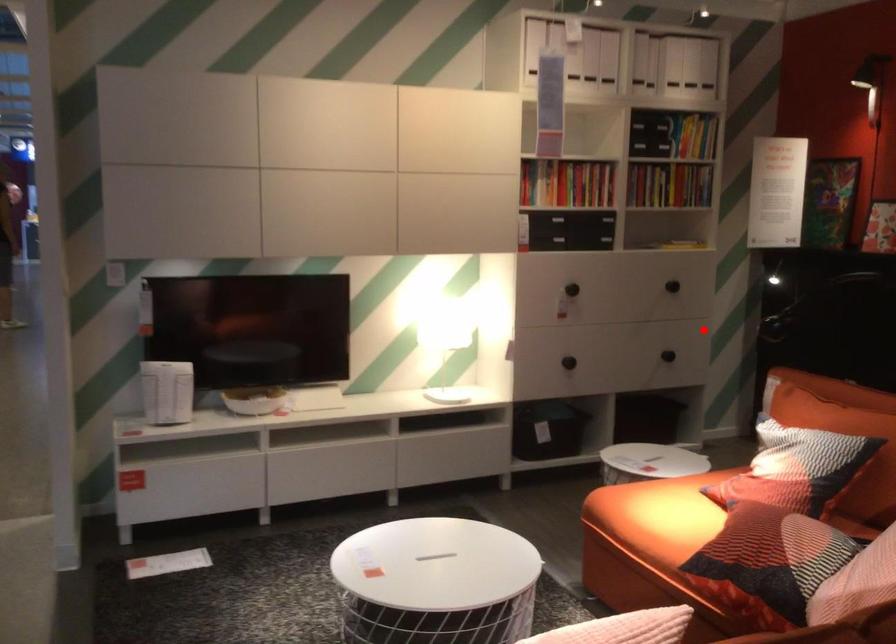
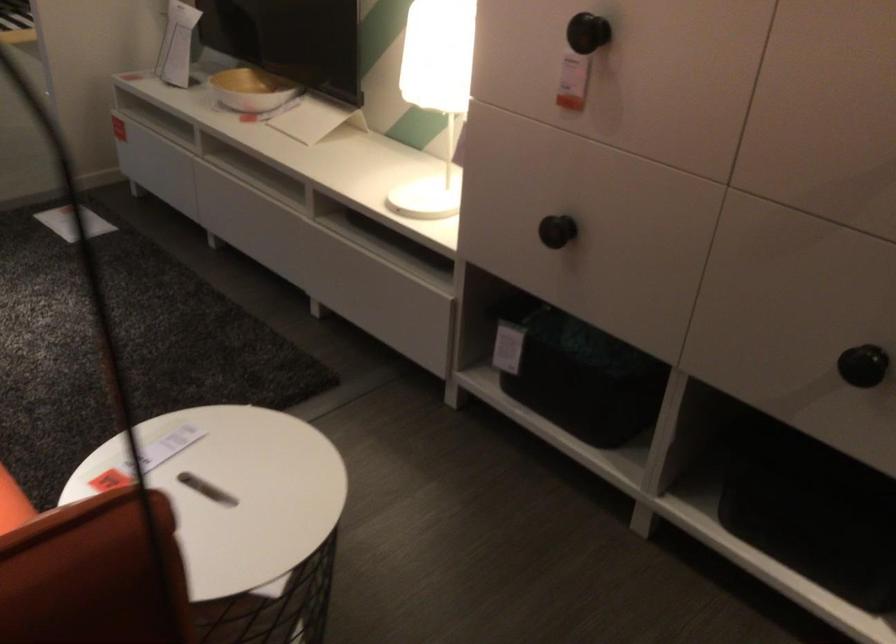
The point at the highlighted location is marked in the first image. Where is the corresponding point in the second image?

(863, 365)